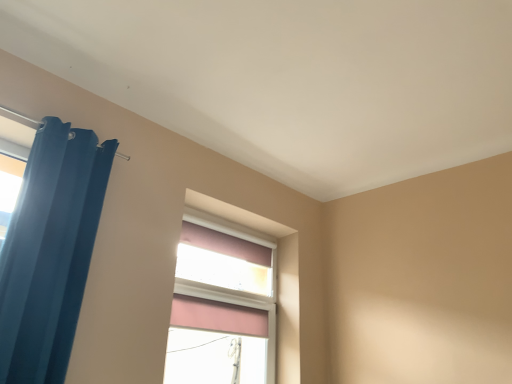
Question: Is matte blue curtain at left shorter than pink fabric window at center?

Choices:
 (A) yes
 (B) no

Answer: (B)

Question: From a real-world perspective, is matte blue curtain at left positioned under pink fabric window at center based on gravity?

Choices:
 (A) yes
 (B) no

Answer: (B)

Question: Is pink fabric window at center at the back of matte blue curtain at left?

Choices:
 (A) no
 (B) yes

Answer: (A)

Question: From the image's perspective, would you say matte blue curtain at left is positioned over pink fabric window at center?

Choices:
 (A) no
 (B) yes

Answer: (B)

Question: Is matte blue curtain at left in contact with pink fabric window at center?

Choices:
 (A) no
 (B) yes

Answer: (A)

Question: Is matte blue curtain at left to the left of pink fabric window at center from the viewer's perspective?

Choices:
 (A) yes
 (B) no

Answer: (A)

Question: Considering the relative positions of pink fabric window at center and matte blue curtain at left in the image provided, is pink fabric window at center to the right of matte blue curtain at left from the viewer's perspective?

Choices:
 (A) yes
 (B) no

Answer: (A)

Question: Does pink fabric window at center have a smaller size compared to matte blue curtain at left?

Choices:
 (A) yes
 (B) no

Answer: (A)

Question: Is the depth of pink fabric window at center greater than that of matte blue curtain at left?

Choices:
 (A) no
 (B) yes

Answer: (B)

Question: Is pink fabric window at center in contact with matte blue curtain at left?

Choices:
 (A) no
 (B) yes

Answer: (A)

Question: Considering the relative sizes of pink fabric window at center and matte blue curtain at left in the image provided, is pink fabric window at center bigger than matte blue curtain at left?

Choices:
 (A) yes
 (B) no

Answer: (B)

Question: Considering the relative sizes of pink fabric window at center and matte blue curtain at left in the image provided, is pink fabric window at center wider than matte blue curtain at left?

Choices:
 (A) no
 (B) yes

Answer: (A)

Question: Is matte blue curtain at left bigger or smaller than pink fabric window at center?

Choices:
 (A) big
 (B) small

Answer: (A)